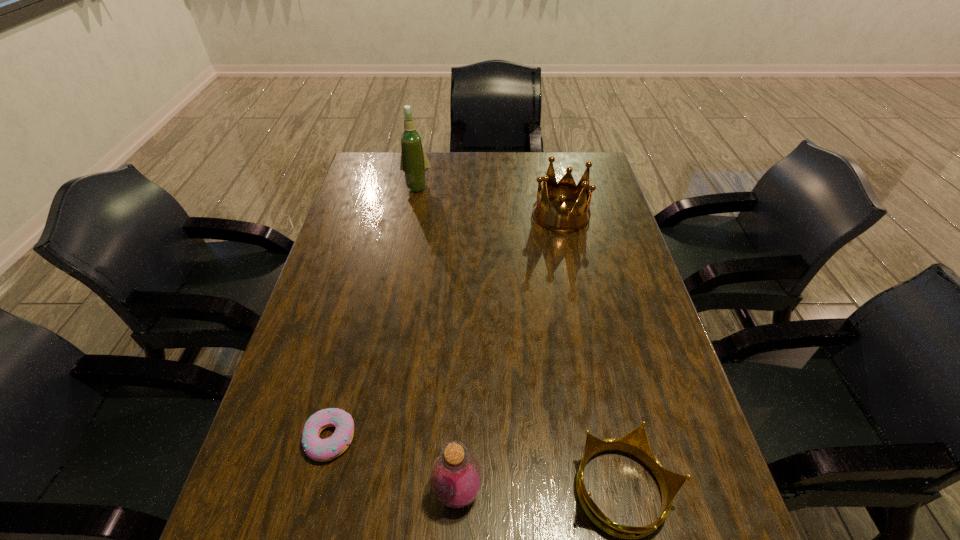
In order to click on wine bottle in this screenshot , I will do `click(414, 163)`.

At what (x,y) coordinates should I click in order to perform the action: click on the tallest object. Please return your answer as a coordinate pair (x, y). The height and width of the screenshot is (540, 960). Looking at the image, I should click on (414, 163).

What are the coordinates of `the farther crown` in the screenshot? It's located at (558, 219).

Locate an element on the screen. the second farthest object is located at coordinates (558, 219).

I want to click on bottle, so click(456, 477).

The image size is (960, 540). I want to click on doughnut, so click(x=322, y=450).

In order to click on vacant area located on the front-facing side of the farthest object in this screenshot , I will do pos(411,221).

This screenshot has width=960, height=540. I want to click on free region located on the back of the second farthest object, so click(554, 185).

This screenshot has height=540, width=960. In order to click on blank space located 0.090m on the left of the bottle in this screenshot , I will do `click(386, 491)`.

You are a GUI agent. You are given a task and a screenshot of the screen. Output one action in this format:
    pyautogui.click(x=<x>, y=<y>)
    Task: Click on the free point located on the back of the doughnut
    This screenshot has height=540, width=960.
    Given the screenshot: What is the action you would take?
    pyautogui.click(x=359, y=321)